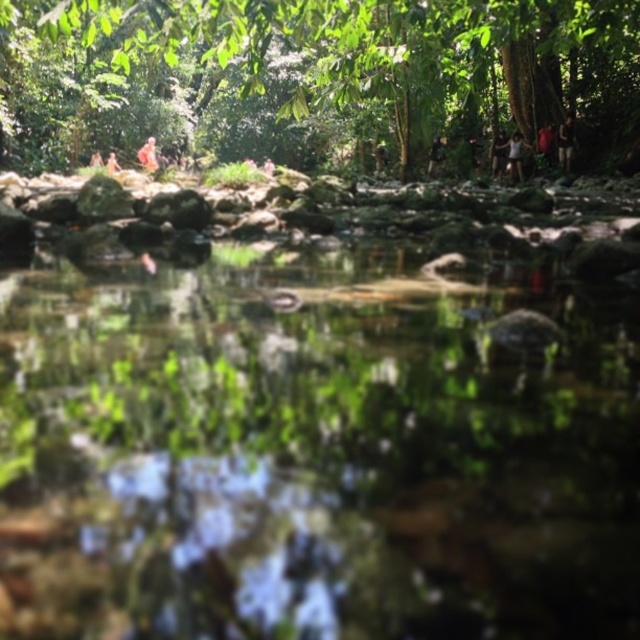
You are an observer standing in the serene natural scene. You see a dark brown leather jacket at upper right and a dark brown leather jacket at upper center. Which jacket is positioned to the right of the other?

The dark brown leather jacket at upper right is positioned to the right of the dark brown leather jacket at upper center.